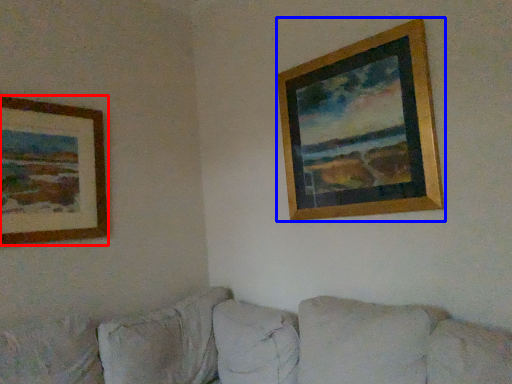
Question: Which object appears closest to the camera in this image, picture frame (highlighted by a red box) or picture frame (highlighted by a blue box)?

Choices:
 (A) picture frame
 (B) picture frame

Answer: (B)